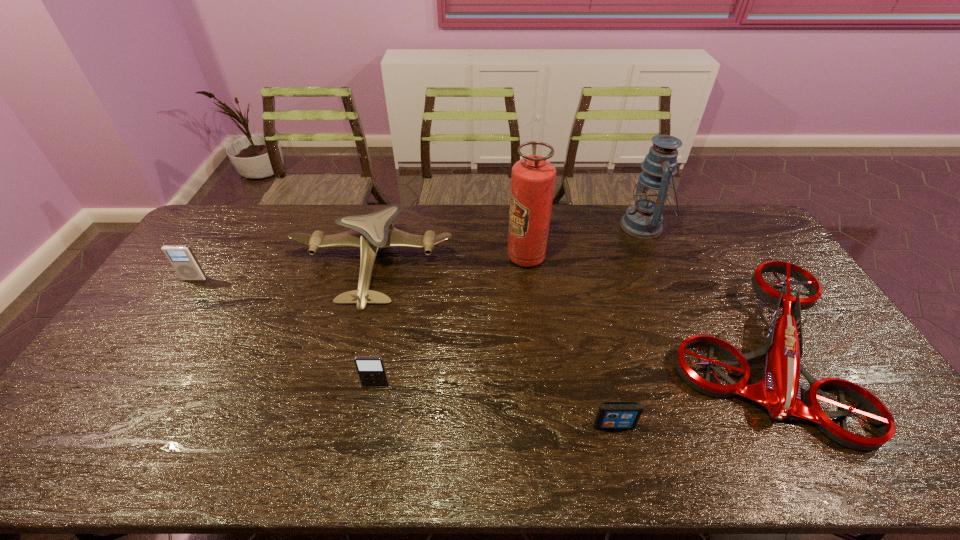
I want to click on fire extinguisher, so click(532, 179).

The width and height of the screenshot is (960, 540). I want to click on lantern, so click(644, 219).

At what (x,y) coordinates should I click in order to perform the action: click on the tallest iPod. Please return your answer as a coordinate pair (x, y). Looking at the image, I should click on (181, 257).

The width and height of the screenshot is (960, 540). In order to click on the leftmost object in this screenshot , I will do `click(181, 257)`.

The image size is (960, 540). What are the coordinates of `the left drone` in the screenshot? It's located at (370, 232).

Locate an element on the screen. the second nearest iPod is located at coordinates (371, 369).

This screenshot has width=960, height=540. Find the location of `the second shortest iPod`. the second shortest iPod is located at coordinates (371, 369).

The image size is (960, 540). I want to click on the right drone, so click(779, 392).

This screenshot has height=540, width=960. Find the location of `the shortest object`. the shortest object is located at coordinates (611, 415).

Find the location of `the third object from right to left`. the third object from right to left is located at coordinates [x=611, y=415].